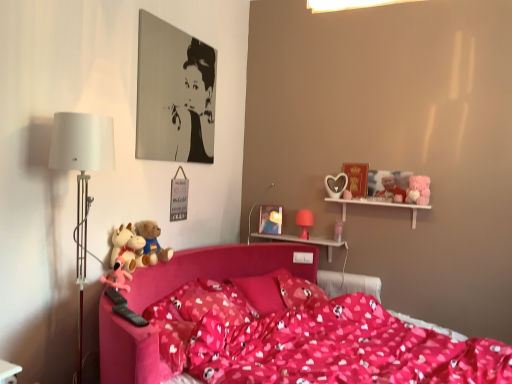
Question: Considering the relative sizes of pink matte table lamp at upper right, which is the second table lamp from front to back, and fluffy pink plush at lower left, the first toy viewed from the left, in the image provided, is pink matte table lamp at upper right, which is the second table lamp from front to back, bigger than fluffy pink plush at lower left, the first toy viewed from the left,?

Choices:
 (A) yes
 (B) no

Answer: (B)

Question: Is pink matte table lamp at upper right, positioned as the second table lamp in left-to-right order, aimed at fluffy pink plush at lower left, the fourth toy when ordered from right to left?

Choices:
 (A) yes
 (B) no

Answer: (B)

Question: Does pink matte table lamp at upper right, which is counted as the 1th table lamp, starting from the right, appear on the right side of fluffy pink plush at lower left, the fourth toy when ordered from right to left?

Choices:
 (A) yes
 (B) no

Answer: (A)

Question: From the image's perspective, is pink matte table lamp at upper right, positioned as the second table lamp in left-to-right order, located beneath fluffy pink plush at lower left, the fourth toy when ordered from right to left?

Choices:
 (A) no
 (B) yes

Answer: (A)

Question: Considering the relative sizes of pink matte table lamp at upper right, which appears as the first table lamp when viewed from the back, and fluffy pink plush at lower left, which ranks as the second toy in front-to-back order, in the image provided, is pink matte table lamp at upper right, which appears as the first table lamp when viewed from the back, smaller than fluffy pink plush at lower left, which ranks as the second toy in front-to-back order,?

Choices:
 (A) no
 (B) yes

Answer: (B)

Question: Can you confirm if pink matte table lamp at upper right, which appears as the first table lamp when viewed from the back, is thinner than fluffy pink plush at lower left, which ranks as the second toy in front-to-back order?

Choices:
 (A) no
 (B) yes

Answer: (B)

Question: Is fluffy pink teddy bear at upper right touching pink plastic shelf at upper center, the 1th table when ordered from right to left?

Choices:
 (A) no
 (B) yes

Answer: (A)

Question: Could you tell me if fluffy pink teddy bear at upper right is turned towards pink plastic shelf at upper center, arranged as the 2th table when viewed from the left?

Choices:
 (A) yes
 (B) no

Answer: (B)

Question: Is fluffy pink teddy bear at upper right closer to camera compared to pink plastic shelf at upper center, the second table positioned from the front?

Choices:
 (A) yes
 (B) no

Answer: (A)

Question: From the image's perspective, is fluffy pink teddy bear at upper right over pink plastic shelf at upper center, placed as the 2th table when sorted from bottom to top?

Choices:
 (A) no
 (B) yes

Answer: (B)

Question: Does fluffy pink teddy bear at upper right have a greater width compared to pink plastic shelf at upper center, the first table from the top?

Choices:
 (A) no
 (B) yes

Answer: (A)

Question: From a real-world perspective, is fluffy pink teddy bear at upper right on top of pink plastic shelf at upper center, marked as the 1th table in a back-to-front arrangement?

Choices:
 (A) no
 (B) yes

Answer: (B)

Question: Is white glossy table at lower left, placed as the first table when sorted from bottom to top, located within white wooden shelf at upper right?

Choices:
 (A) no
 (B) yes

Answer: (A)